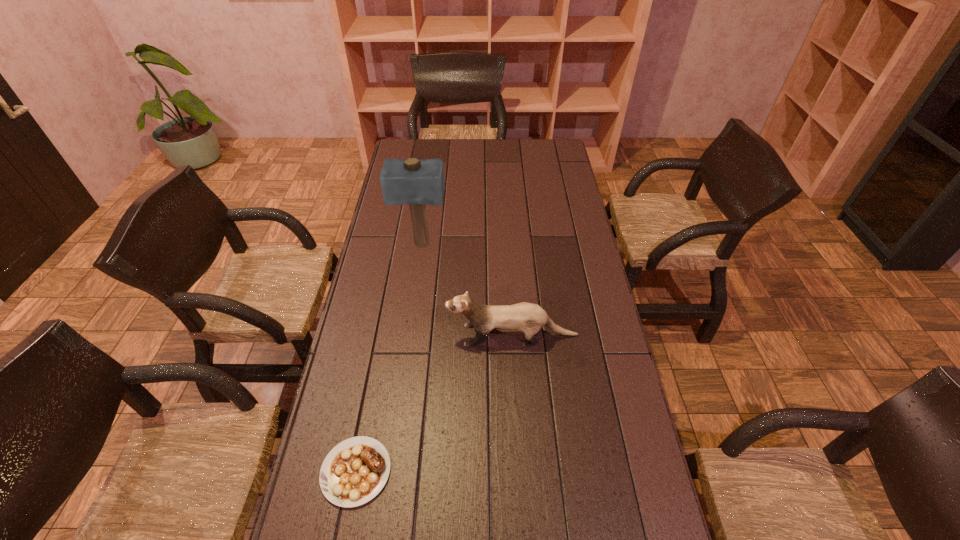
The image size is (960, 540). I want to click on vacant space located 0.080m on the right of the steak, so click(x=423, y=471).

This screenshot has width=960, height=540. In order to click on mallet located at the left edge in this screenshot , I will do `click(410, 181)`.

Identify the location of steak that is at the left edge. (354, 471).

Locate an element on the screen. This screenshot has height=540, width=960. object that is at the right edge is located at coordinates (529, 318).

Locate an element on the screen. This screenshot has width=960, height=540. blank space at the far edge is located at coordinates (518, 139).

This screenshot has width=960, height=540. In the image, there is a desktop. In order to click on free region at the left edge in this screenshot , I will do `click(376, 313)`.

You are a GUI agent. You are given a task and a screenshot of the screen. Output one action in this format:
    pyautogui.click(x=<x>, y=<y>)
    Task: Click on the blank space at the right edge
    
    Given the screenshot: What is the action you would take?
    pyautogui.click(x=596, y=269)

The image size is (960, 540). In the image, there is a desktop. In order to click on vacant space at the far left corner in this screenshot , I will do `click(399, 140)`.

Find the location of a particular element. This screenshot has width=960, height=540. vacant point located between the nearest object and the second shortest object is located at coordinates (434, 403).

Locate an element on the screen. Image resolution: width=960 pixels, height=540 pixels. free space between the tallest object and the shortest object is located at coordinates (389, 358).